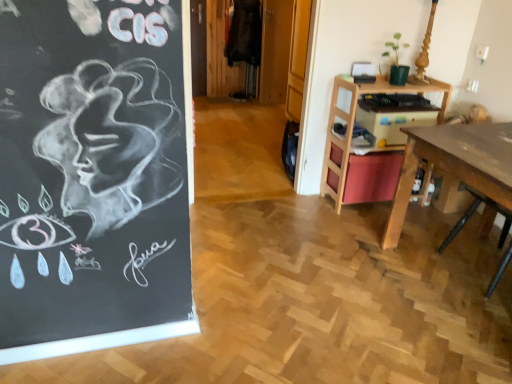
Identify the location of vacant space situated on the left part of wooden desk at right. pyautogui.click(x=307, y=210).